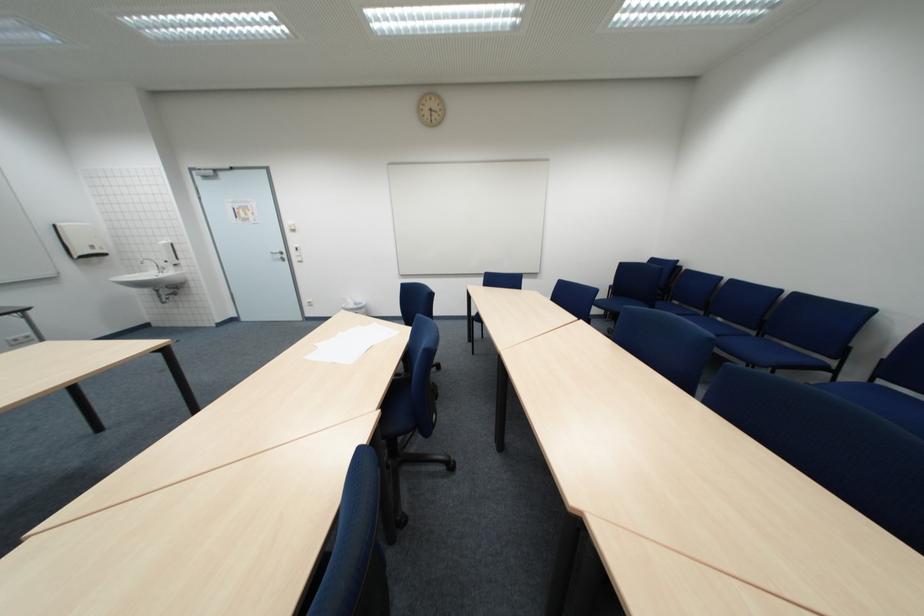
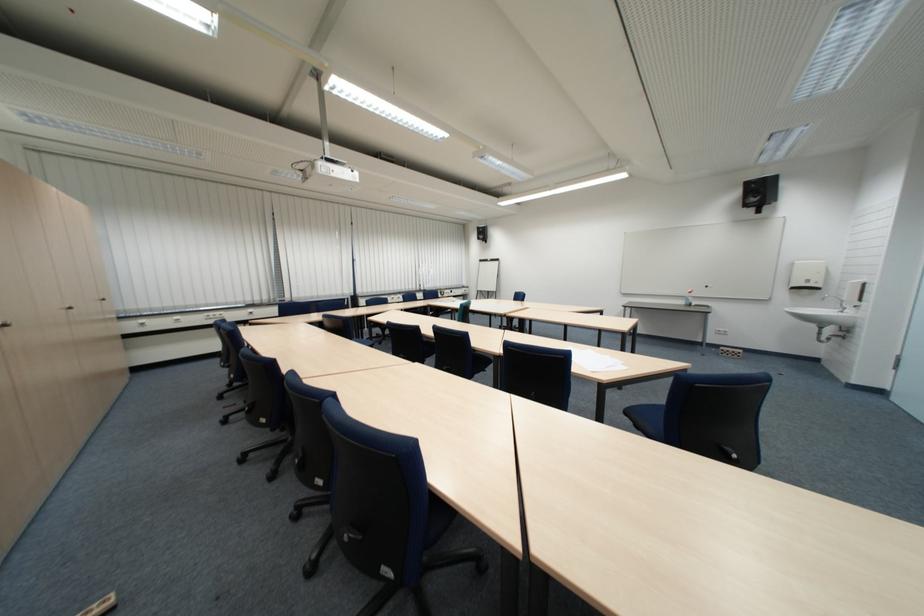
Find the pixel in the second image that matches [179,257] in the first image.

(860, 296)